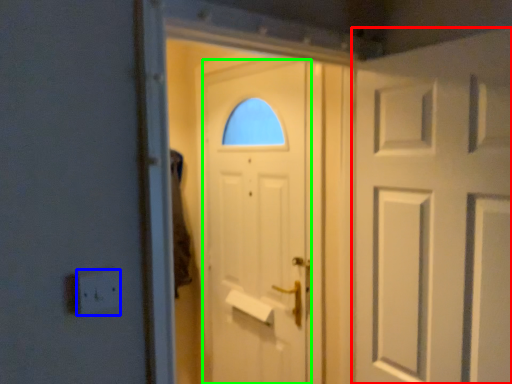
Question: Which is farther away from door (highlighted by a red box)? electric outlet (highlighted by a blue box) or door (highlighted by a green box)?

Choices:
 (A) electric outlet
 (B) door

Answer: (A)